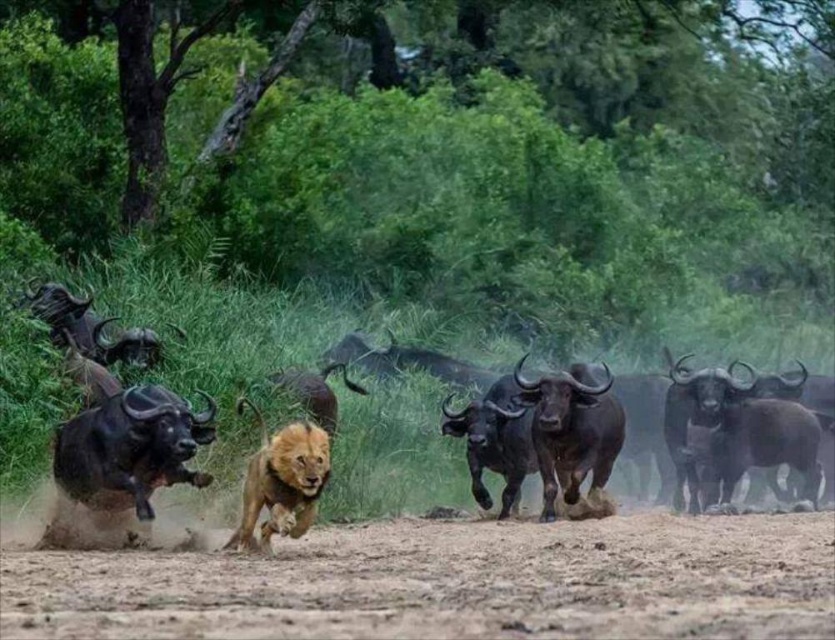
Is point (462, 586) positioned before point (213, 401)?

Yes, point (462, 586) is in front of point (213, 401).

Who is more forward, (757,634) or (140,388)?

Positioned in front is point (757,634).

Which is in front, point (497, 582) or point (152, 513)?

Point (497, 582) is in front.

The image size is (835, 640). In order to click on brown dusty ground at center in this screenshot , I will do `click(449, 582)`.

Is brown rough horned yak at left further to the viewer compared to golden fur lion at center?

Yes, brown rough horned yak at left is behind golden fur lion at center.

You are a GUI agent. You are given a task and a screenshot of the screen. Output one action in this format:
    pyautogui.click(x=<x>, y=<y>)
    Task: Click on the brown rough horned yak at left
    
    Given the screenshot: What is the action you would take?
    pyautogui.click(x=130, y=449)

Which is behind, point (196, 392) or point (296, 429)?

Point (196, 392)

Find the location of a particular element. brown rough horned yak at left is located at coordinates (130, 449).

Which of these two, black glossy buffalo at center or brown rough horned yak at left, stands shorter?

Standing shorter between the two is black glossy buffalo at center.

Is black glossy buffalo at center shorter than brown rough horned yak at left?

Correct, black glossy buffalo at center is not as tall as brown rough horned yak at left.

Find the location of a particular element. This screenshot has width=835, height=640. black glossy buffalo at center is located at coordinates click(x=186, y=435).